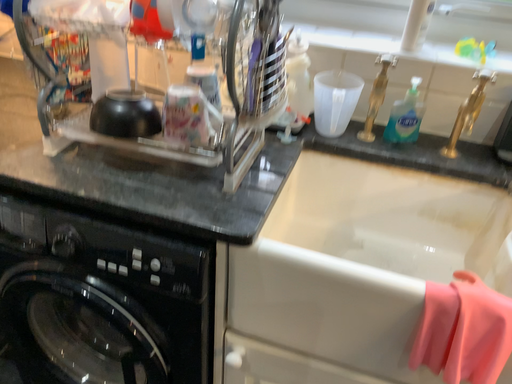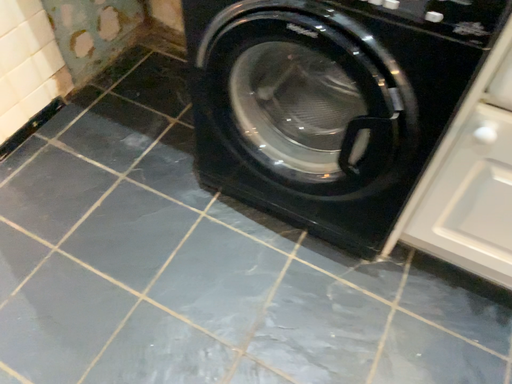
Question: Which way did the camera rotate in the video?

Choices:
 (A) rotated right
 (B) rotated left

Answer: (B)